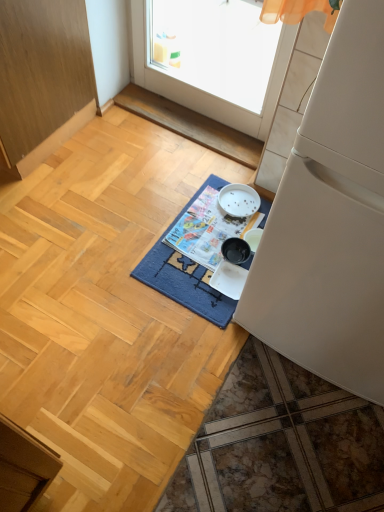
At what (x,y) coordinates should I click in order to perform the action: click on vacant area that lies in front of printed paper magazine at center. Please return your answer as a coordinate pair (x, y). Looking at the image, I should click on (189, 284).